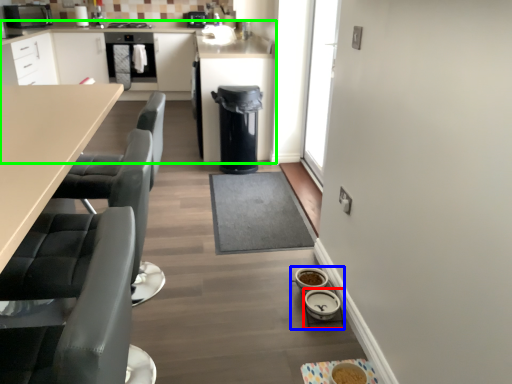
Question: Which object is the farthest from appliance (highlighted by a red box)? Choose among these: appliance (highlighted by a blue box) or cabinetry (highlighted by a green box).

Choices:
 (A) appliance
 (B) cabinetry

Answer: (B)